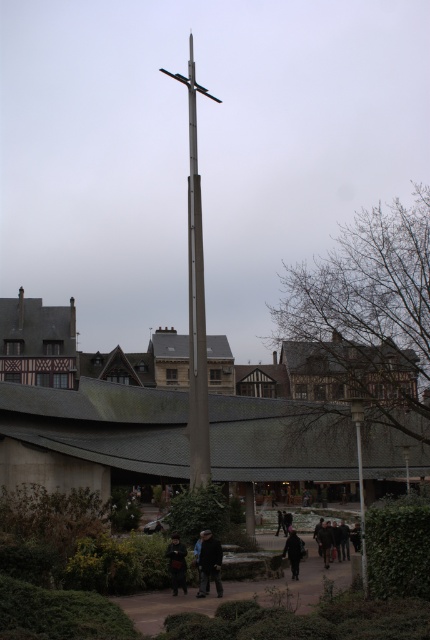
Question: Among these points, which one is farthest from the camera?

Choices:
 (A) (343, 531)
 (B) (187, 216)
 (C) (286, 538)

Answer: (B)

Question: Which point is closer to the camera taking this photo?

Choices:
 (A) (343, 541)
 (B) (282, 515)

Answer: (A)

Question: Does metallic gray pole at center appear over dark gray jacket at center?

Choices:
 (A) no
 (B) yes

Answer: (B)

Question: Which point is closer to the camera?

Choices:
 (A) (181, 570)
 (B) (335, 531)

Answer: (A)

Question: Can you confirm if dark blue jeans at lower center is smaller than dark brown leather coat at lower center?

Choices:
 (A) yes
 (B) no

Answer: (B)

Question: Does dark matte jacket at center come behind dark gray jacket at center?

Choices:
 (A) no
 (B) yes

Answer: (A)